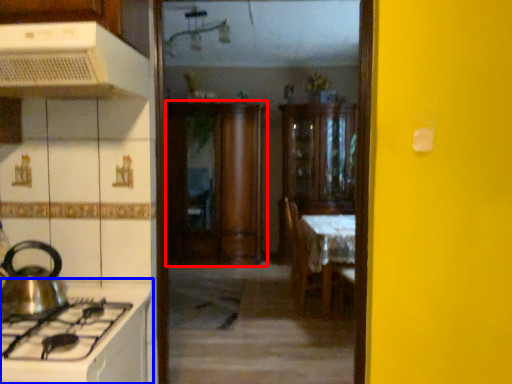
Question: Which of the following is the closest to the observer, cabinetry (highlighted by a red box) or countertop (highlighted by a blue box)?

Choices:
 (A) cabinetry
 (B) countertop

Answer: (B)